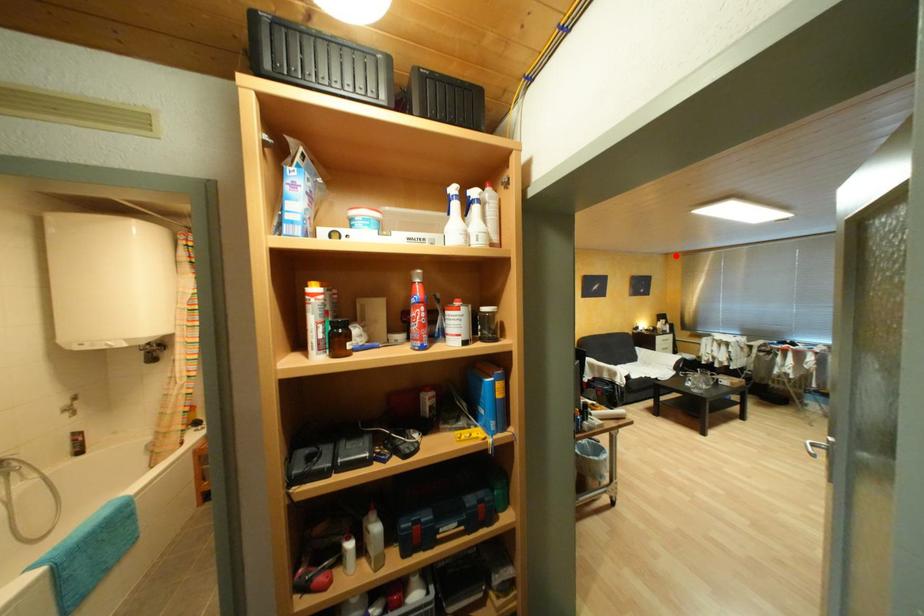
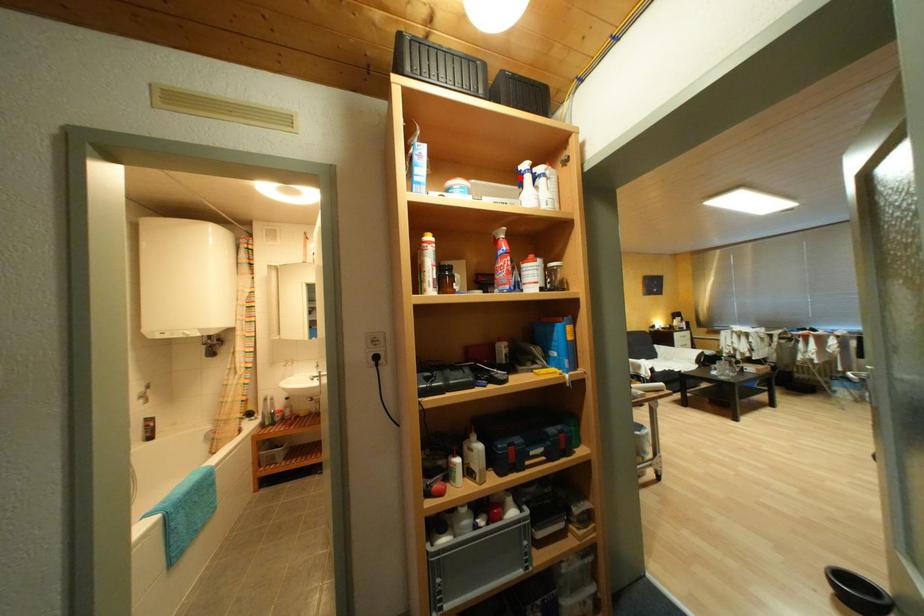
I am providing you with two images of the same scene from different viewpoints. A red point is marked on the first image and another point is marked on the second image. Does the point marked in image1 correspond to the same location as the one in image2?

No